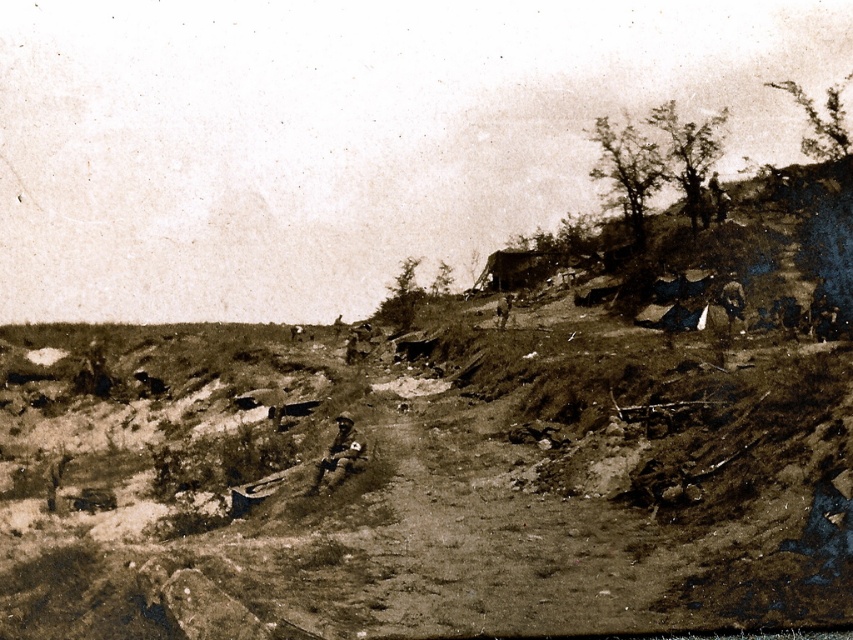
Question: Can you confirm if brown leather jacket at center is positioned above dark brown leather jacket at upper right?

Choices:
 (A) no
 (B) yes

Answer: (A)

Question: Does brown leather jacket at center have a greater width compared to dark brown leather jacket at upper right?

Choices:
 (A) no
 (B) yes

Answer: (A)

Question: Among these points, which one is farthest from the camera?

Choices:
 (A) (502, 298)
 (B) (352, 452)
 (C) (733, 326)

Answer: (A)

Question: Does brown leather jacket at center appear on the left side of dark brown leather jacket at center?

Choices:
 (A) no
 (B) yes

Answer: (B)

Question: Which object is positioned closest to the brown leather jacket at center?

Choices:
 (A) dark brown leather jacket at upper right
 (B) dark brown leather jacket at center

Answer: (A)

Question: Which point is closer to the camera?

Choices:
 (A) brown leather jacket at center
 (B) dark brown leather jacket at center
 (C) dark brown leather jacket at upper right

Answer: (A)